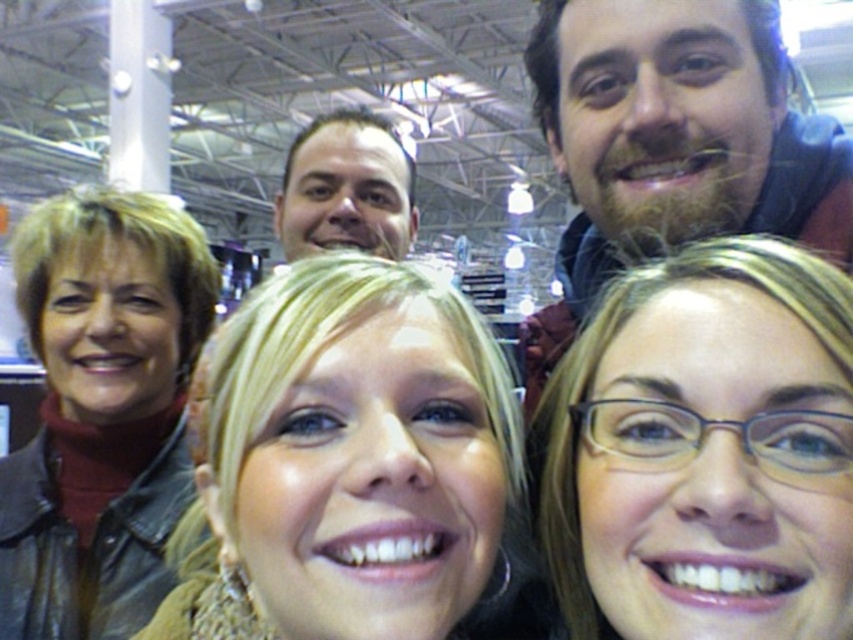
You are a photographer standing at a certain distance from the group. You want to take a closeup shot of the blonde hair at center without moving the group. Can you estimate if you can achieve this with a standard zoom lens that has a maximum focal length of 200mm?

The distance between the blonde hair at center and the viewer is 38.26 centimeters. With a standard zoom lens up to 200mm, you can easily capture a closeup of the blonde hair at center from this short distance.

Looking at the group photo, where is the matte brown hair at lower right in relation to the smooth brown hair at center?

The matte brown hair at lower right is positioned to the right of smooth brown hair at center.